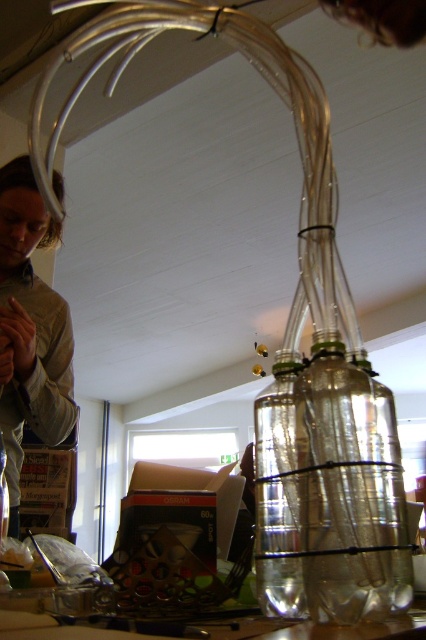
Is transparent plastic bottles at center to the right of clear glass bottle at center from the viewer's perspective?

Indeed, transparent plastic bottles at center is positioned on the right side of clear glass bottle at center.

Between point (400, 605) and point (282, 474), which one is positioned behind?

Point (282, 474)

Where is `transparent plastic bottles at center`? This screenshot has width=426, height=640. transparent plastic bottles at center is located at coordinates (350, 490).

This screenshot has height=640, width=426. I want to click on transparent plastic bottles at center, so click(350, 490).

What do you see at coordinates (29, 330) in the screenshot? I see `matte brown hair at upper left` at bounding box center [29, 330].

Is point (6, 252) positioned before point (278, 493)?

No, it is not.

You are a GUI agent. You are given a task and a screenshot of the screen. Output one action in this format:
    pyautogui.click(x=<x>, y=<y>)
    Task: Click on the matte brown hair at upper left
    
    Given the screenshot: What is the action you would take?
    pyautogui.click(x=29, y=330)

The image size is (426, 640). What do you see at coordinates (350, 490) in the screenshot? I see `transparent plastic bottles at center` at bounding box center [350, 490].

Is point (351, 371) in front of point (66, 358)?

That is True.

Is point (356, 404) in front of point (40, 348)?

Yes.

This screenshot has height=640, width=426. Find the location of `transparent plastic bottles at center`. transparent plastic bottles at center is located at coordinates (350, 490).